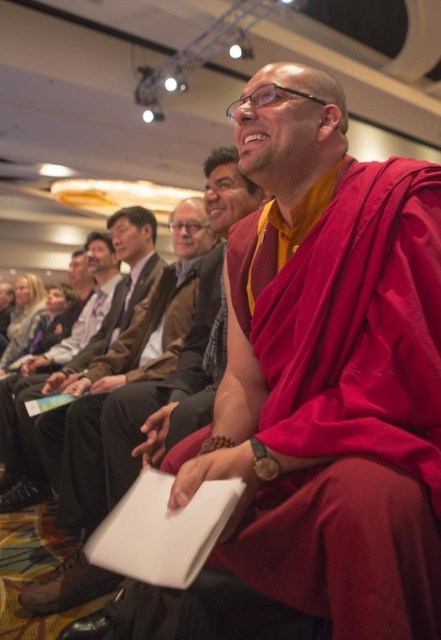
Question: Among these points, which one is nearest to the camera?

Choices:
 (A) (134, 403)
 (B) (154, 230)

Answer: (A)

Question: Can you confirm if maroon silk robe at center is positioned below brown leather jacket at center?

Choices:
 (A) no
 (B) yes

Answer: (B)

Question: Can you confirm if maroon silk robe at center is bigger than brown leather jacket at center?

Choices:
 (A) yes
 (B) no

Answer: (B)

Question: Among these objects, which one is farthest from the camera?

Choices:
 (A) maroon silk robe at center
 (B) brown leather jacket at center

Answer: (B)

Question: Is maroon silk robe at center to the right of brown leather jacket at center from the viewer's perspective?

Choices:
 (A) yes
 (B) no

Answer: (A)